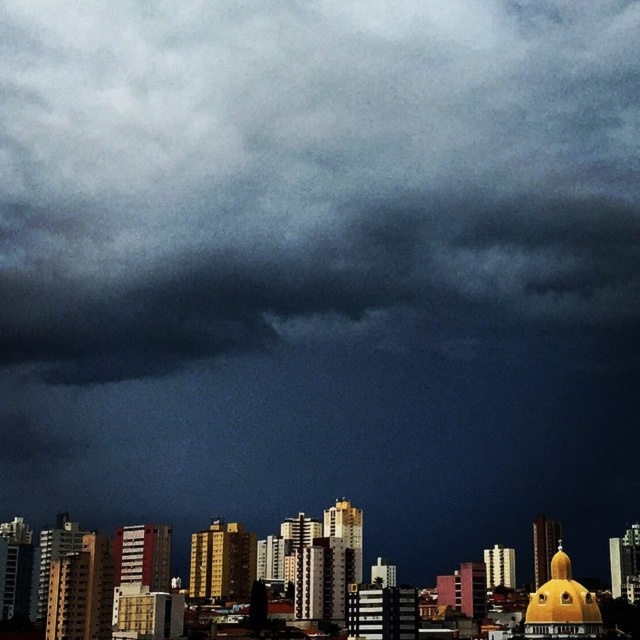
Question: Observing the image, what is the correct spatial positioning of dark gray cloud at upper center in reference to dark gray cloud at center?

Choices:
 (A) below
 (B) above

Answer: (B)

Question: Which point is farther from the camera taking this photo?

Choices:
 (A) (541, 547)
 (B) (294, 12)

Answer: (B)

Question: Which point is farther to the camera?

Choices:
 (A) dark gray cloud at center
 (B) dark gray cloud at upper center

Answer: (B)

Question: Among these objects, which one is nearest to the camera?

Choices:
 (A) dark gray cloud at center
 (B) dark gray cloud at upper center

Answer: (A)

Question: Can you confirm if dark gray cloud at upper center is positioned to the right of dark gray cloud at center?

Choices:
 (A) no
 (B) yes

Answer: (B)

Question: Does dark gray cloud at upper center have a larger size compared to dark gray cloud at center?

Choices:
 (A) yes
 (B) no

Answer: (B)